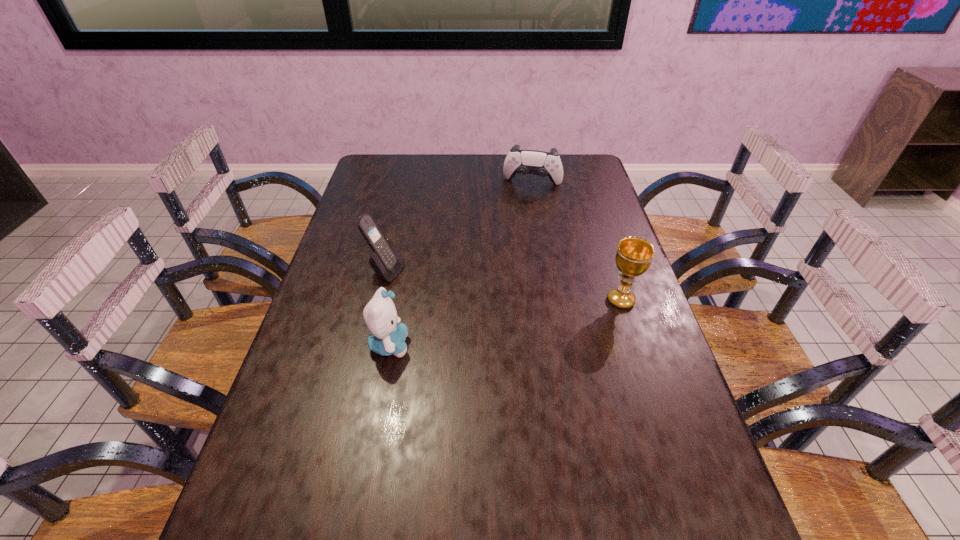
You are a GUI agent. You are given a task and a screenshot of the screen. Output one action in this format:
    pyautogui.click(x=<x>, y=<y>)
    Task: Click on the vacant spot on the desktop that is between the nearest object and the third farthest object and is positioned on the front-facing side of the farthest object
    The width and height of the screenshot is (960, 540).
    Given the screenshot: What is the action you would take?
    pyautogui.click(x=504, y=323)

Locate an element on the screen. This screenshot has width=960, height=540. vacant space on the desktop that is between the nearest object and the rightmost object and is positioned on the front-facing side of the cellular telephone is located at coordinates (527, 319).